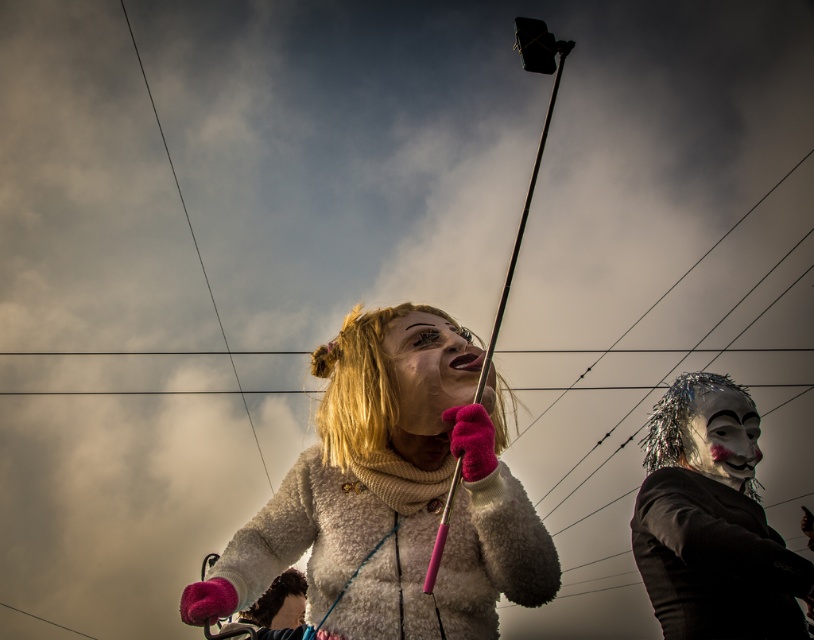
You are a costume designer observing the image. You need to determine which costume element is wider between the fluffy white coat at center and the silvery metallic mask at upper right. Which one is wider?

The fluffy white coat at center is wider than the silvery metallic mask at upper right according to the description.

You are a photographer trying to capture a clear photo of the smooth white mask at center without the fluffy white coat at center blocking it. Based on their positions, is this possible?

The fluffy white coat at center is in front of the smooth white mask at center, so it is blocking the view. To capture a clear photo of the smooth white mask at center without the fluffy white coat at center blocking it, you would need to move the coat or mask so that the mask is no longer behind the coat.